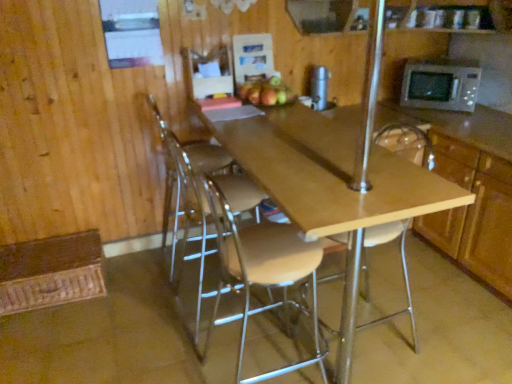
Question: Is the position of light wood/matte table at center less distant than that of light brown wood stool at center, positioned as the 2th chair in right-to-left order?

Choices:
 (A) no
 (B) yes

Answer: (B)

Question: From a real-world perspective, is light wood/matte table at center positioned over light brown wood stool at center, positioned as the 2th chair in right-to-left order, based on gravity?

Choices:
 (A) no
 (B) yes

Answer: (A)

Question: Is light wood/matte table at center not within light brown wood stool at center, positioned as the second chair in left-to-right order?

Choices:
 (A) no
 (B) yes

Answer: (B)

Question: Considering the relative positions of light wood/matte table at center and light brown wood stool at center, positioned as the 2th chair in right-to-left order, in the image provided, is light wood/matte table at center to the left of light brown wood stool at center, positioned as the 2th chair in right-to-left order, from the viewer's perspective?

Choices:
 (A) no
 (B) yes

Answer: (A)

Question: Is light wood/matte table at center positioned far away from light brown wood stool at center, positioned as the 2th chair in right-to-left order?

Choices:
 (A) no
 (B) yes

Answer: (A)

Question: Can you confirm if light wood/matte table at center is thinner than light brown wood stool at center, positioned as the 2th chair in right-to-left order?

Choices:
 (A) no
 (B) yes

Answer: (A)

Question: Does clear plastic chair at center, which is the third chair from right to left, have a larger size compared to silver metallic thermos at upper center?

Choices:
 (A) no
 (B) yes

Answer: (B)

Question: Is clear plastic chair at center, which is the third chair from right to left, not within silver metallic thermos at upper center?

Choices:
 (A) yes
 (B) no

Answer: (A)

Question: From the image's perspective, is clear plastic chair at center, which is counted as the first chair, starting from the left, below silver metallic thermos at upper center?

Choices:
 (A) no
 (B) yes

Answer: (B)

Question: Is clear plastic chair at center, which is counted as the first chair, starting from the left, further to the viewer compared to silver metallic thermos at upper center?

Choices:
 (A) no
 (B) yes

Answer: (A)

Question: Could silver metallic thermos at upper center be considered to be inside clear plastic chair at center, which is the third chair from right to left?

Choices:
 (A) no
 (B) yes

Answer: (A)

Question: Can you confirm if clear plastic chair at center, which is the third chair from right to left, is taller than silver metallic thermos at upper center?

Choices:
 (A) yes
 (B) no

Answer: (A)

Question: Are matte brown apple at center and light wood/matte table at center beside each other?

Choices:
 (A) yes
 (B) no

Answer: (B)